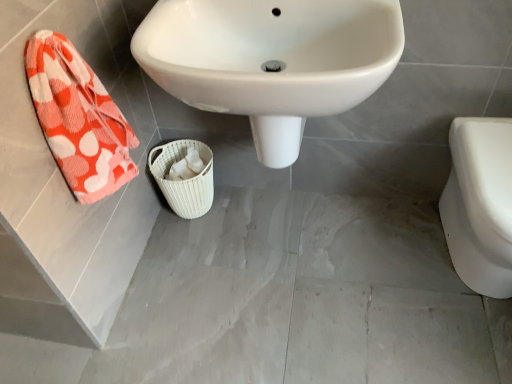
Question: Does orange-patterned towel at left have a smaller size compared to white glossy toilet at right?

Choices:
 (A) yes
 (B) no

Answer: (A)

Question: Is orange-patterned towel at left at the left side of white glossy toilet at right?

Choices:
 (A) yes
 (B) no

Answer: (A)

Question: Is orange-patterned towel at left not close to white glossy toilet at right?

Choices:
 (A) no
 (B) yes

Answer: (B)

Question: Does orange-patterned towel at left come in front of white glossy toilet at right?

Choices:
 (A) yes
 (B) no

Answer: (A)

Question: Can you confirm if orange-patterned towel at left is thinner than white glossy toilet at right?

Choices:
 (A) yes
 (B) no

Answer: (A)

Question: Can you confirm if orange-patterned towel at left is bigger than white glossy toilet at right?

Choices:
 (A) yes
 (B) no

Answer: (B)

Question: Is white glossy toilet at right further to the viewer compared to white glossy sink at center?

Choices:
 (A) yes
 (B) no

Answer: (A)

Question: From the image's perspective, is white glossy toilet at right located beneath white glossy sink at center?

Choices:
 (A) no
 (B) yes

Answer: (B)

Question: Does white glossy toilet at right have a lesser width compared to white glossy sink at center?

Choices:
 (A) no
 (B) yes

Answer: (A)

Question: From the image's perspective, is white glossy toilet at right on top of white glossy sink at center?

Choices:
 (A) yes
 (B) no

Answer: (B)

Question: Would you say white glossy toilet at right contains white glossy sink at center?

Choices:
 (A) no
 (B) yes

Answer: (A)

Question: Does white glossy toilet at right touch white glossy sink at center?

Choices:
 (A) yes
 (B) no

Answer: (B)

Question: Considering the relative sizes of white glossy sink at center and white glossy toilet at right in the image provided, is white glossy sink at center smaller than white glossy toilet at right?

Choices:
 (A) yes
 (B) no

Answer: (B)